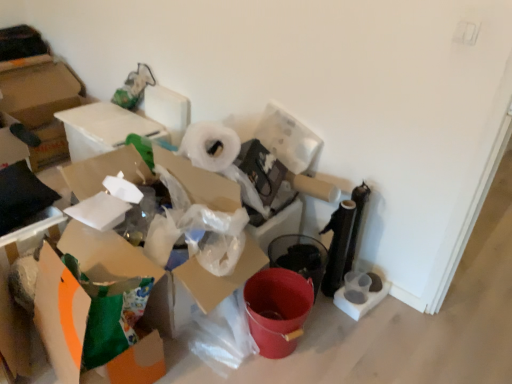
Question: Could you tell me if white cardboard box at upper left, marked as the 3th cardboard box in a front-to-back arrangement, is facing orange matte cardboard box at lower left, the second cardboard box when ordered from front to back?

Choices:
 (A) yes
 (B) no

Answer: (B)

Question: Is white cardboard box at upper left, marked as the 3th cardboard box in a front-to-back arrangement, surrounding orange matte cardboard box at lower left, the second cardboard box when ordered from front to back?

Choices:
 (A) yes
 (B) no

Answer: (B)

Question: Is white cardboard box at upper left, marked as the 1th cardboard box in a back-to-front arrangement, smaller than orange matte cardboard box at lower left, which is the 2th cardboard box in back-to-front order?

Choices:
 (A) no
 (B) yes

Answer: (A)

Question: From a real-world perspective, is white cardboard box at upper left, marked as the 1th cardboard box in a back-to-front arrangement, on orange matte cardboard box at lower left, the second cardboard box when ordered from front to back?

Choices:
 (A) no
 (B) yes

Answer: (B)

Question: Is white cardboard box at upper left, marked as the 3th cardboard box in a front-to-back arrangement, closer to camera compared to orange matte cardboard box at lower left, the second cardboard box when ordered from front to back?

Choices:
 (A) yes
 (B) no

Answer: (B)

Question: Is point (68, 135) positioned closer to the camera than point (376, 301)?

Choices:
 (A) farther
 (B) closer

Answer: (A)

Question: Considering the positions of white cardboard box at upper left, marked as the 3th cardboard box in a front-to-back arrangement, and transparent plastic toilet paper at lower right in the image, is white cardboard box at upper left, marked as the 3th cardboard box in a front-to-back arrangement, bigger or smaller than transparent plastic toilet paper at lower right?

Choices:
 (A) small
 (B) big

Answer: (B)

Question: Looking at their shapes, would you say white cardboard box at upper left, marked as the 3th cardboard box in a front-to-back arrangement, is wider or thinner than transparent plastic toilet paper at lower right?

Choices:
 (A) wide
 (B) thin

Answer: (A)

Question: Considering their positions, is white cardboard box at upper left, marked as the 3th cardboard box in a front-to-back arrangement, located in front of or behind transparent plastic toilet paper at lower right?

Choices:
 (A) behind
 (B) front

Answer: (A)

Question: From a real-world perspective, is orange matte cardboard box at lower left, the second cardboard box when ordered from front to back, above or below transparent plastic toilet paper at lower right?

Choices:
 (A) below
 (B) above

Answer: (B)

Question: Based on their sizes in the image, would you say orange matte cardboard box at lower left, which is the 2th cardboard box in back-to-front order, is bigger or smaller than transparent plastic toilet paper at lower right?

Choices:
 (A) small
 (B) big

Answer: (B)

Question: Considering the positions of orange matte cardboard box at lower left, which is the 2th cardboard box in back-to-front order, and transparent plastic toilet paper at lower right in the image, is orange matte cardboard box at lower left, which is the 2th cardboard box in back-to-front order, wider or thinner than transparent plastic toilet paper at lower right?

Choices:
 (A) thin
 (B) wide

Answer: (B)

Question: Considering their positions, is orange matte cardboard box at lower left, which is the 2th cardboard box in back-to-front order, located in front of or behind transparent plastic toilet paper at lower right?

Choices:
 (A) behind
 (B) front

Answer: (B)

Question: In terms of height, does orange matte cardboard box at lower left, arranged as the 3th cardboard box when viewed from the back, look taller or shorter compared to transparent plastic toilet paper at lower right?

Choices:
 (A) short
 (B) tall

Answer: (B)

Question: Is point (74, 336) positioned closer to the camera than point (343, 294)?

Choices:
 (A) closer
 (B) farther

Answer: (A)